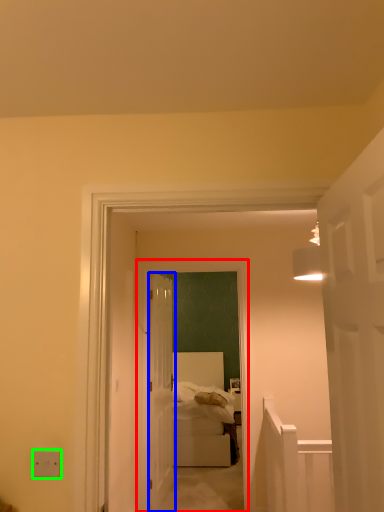
Question: Estimate the real-world distances between objects in this image. Which object is farther from corridor (highlighted by a red box), door (highlighted by a blue box) or electric outlet (highlighted by a green box)?

Choices:
 (A) door
 (B) electric outlet

Answer: (B)